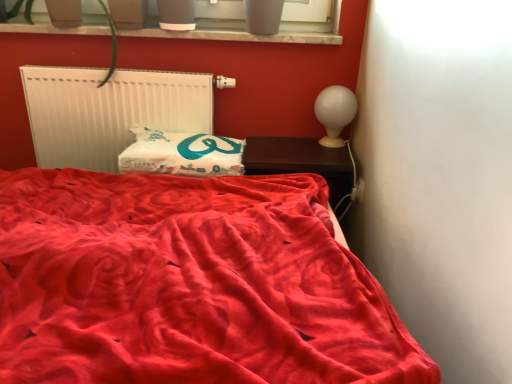
Question: From the image's perspective, is white glossy table lamp at upper right positioned above or below white matte radiator at upper left?

Choices:
 (A) below
 (B) above

Answer: (B)

Question: In terms of width, does white glossy table lamp at upper right look wider or thinner when compared to white matte radiator at upper left?

Choices:
 (A) wide
 (B) thin

Answer: (A)

Question: Considering the real-world distances, which object is closest to the white matte radiator at upper left?

Choices:
 (A) smooth concrete window sill at upper center
 (B) velvet red bed at center
 (C) dark wood nightstand at right
 (D) white soft pillow at center
 (E) white glossy table lamp at upper right

Answer: (D)

Question: Which is nearer to the smooth concrete window sill at upper center?

Choices:
 (A) white matte radiator at upper left
 (B) white glossy table lamp at upper right
 (C) dark wood nightstand at right
 (D) velvet red bed at center
 (E) white soft pillow at center

Answer: (A)